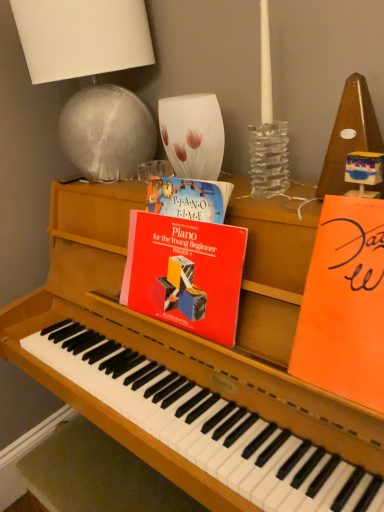
Question: Is white fabric lampshade at upper left looking in the opposite direction of orange matte paper at right, which is counted as the 1th paperback book, starting from the right?

Choices:
 (A) no
 (B) yes

Answer: (A)

Question: From the image's perspective, is white fabric lampshade at upper left beneath orange matte paper at right, which is counted as the 1th paperback book, starting from the right?

Choices:
 (A) no
 (B) yes

Answer: (A)

Question: From a real-world perspective, does white fabric lampshade at upper left stand above orange matte paper at right, placed as the second paperback book when sorted from left to right?

Choices:
 (A) no
 (B) yes

Answer: (B)

Question: Is white fabric lampshade at upper left placed right next to orange matte paper at right, which is counted as the 1th paperback book, starting from the right?

Choices:
 (A) no
 (B) yes

Answer: (A)

Question: Is white fabric lampshade at upper left positioned in front of orange matte paper at right, which is counted as the 1th paperback book, starting from the right?

Choices:
 (A) yes
 (B) no

Answer: (B)

Question: Looking at their shapes, would you say red matte piano book at center, which is the second paperback book in right-to-left order, is wider or thinner than white fabric lampshade at upper left?

Choices:
 (A) thin
 (B) wide

Answer: (A)

Question: Is red matte piano book at center, marked as the first paperback book in a left-to-right arrangement, in front of or behind white fabric lampshade at upper left in the image?

Choices:
 (A) behind
 (B) front

Answer: (B)

Question: In terms of size, does red matte piano book at center, which is the second paperback book in right-to-left order, appear bigger or smaller than white fabric lampshade at upper left?

Choices:
 (A) small
 (B) big

Answer: (A)

Question: Would you say red matte piano book at center, which is the second paperback book in right-to-left order, is to the left or to the right of white fabric lampshade at upper left in the picture?

Choices:
 (A) right
 (B) left

Answer: (A)

Question: Is orange matte paper at right, placed as the second paperback book when sorted from left to right, bigger or smaller than red matte piano book at center, which is the second paperback book in right-to-left order?

Choices:
 (A) small
 (B) big

Answer: (A)

Question: In the image, is orange matte paper at right, which is counted as the 1th paperback book, starting from the right, positioned in front of or behind red matte piano book at center, marked as the first paperback book in a left-to-right arrangement?

Choices:
 (A) behind
 (B) front

Answer: (B)

Question: From a real-world perspective, is orange matte paper at right, placed as the second paperback book when sorted from left to right, above or below red matte piano book at center, which is the second paperback book in right-to-left order?

Choices:
 (A) above
 (B) below

Answer: (A)

Question: Would you say orange matte paper at right, which is counted as the 1th paperback book, starting from the right, is to the left or to the right of red matte piano book at center, which is the second paperback book in right-to-left order, in the picture?

Choices:
 (A) left
 (B) right

Answer: (B)

Question: Is red matte piano book at center, marked as the first paperback book in a left-to-right arrangement, to the left or to the right of orange matte paper at right, placed as the second paperback book when sorted from left to right, in the image?

Choices:
 (A) left
 (B) right

Answer: (A)

Question: In terms of width, does red matte piano book at center, which is the second paperback book in right-to-left order, look wider or thinner when compared to orange matte paper at right, placed as the second paperback book when sorted from left to right?

Choices:
 (A) wide
 (B) thin

Answer: (B)